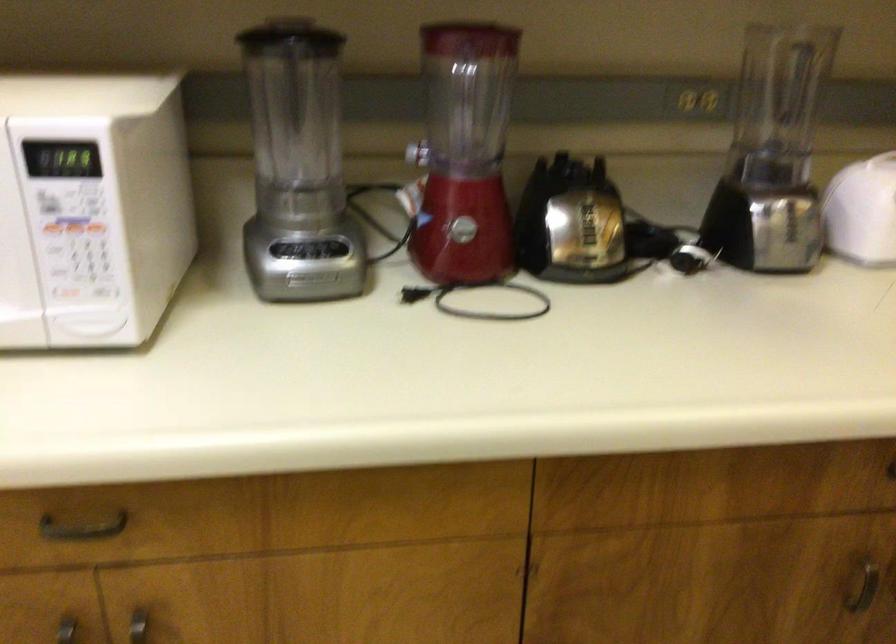
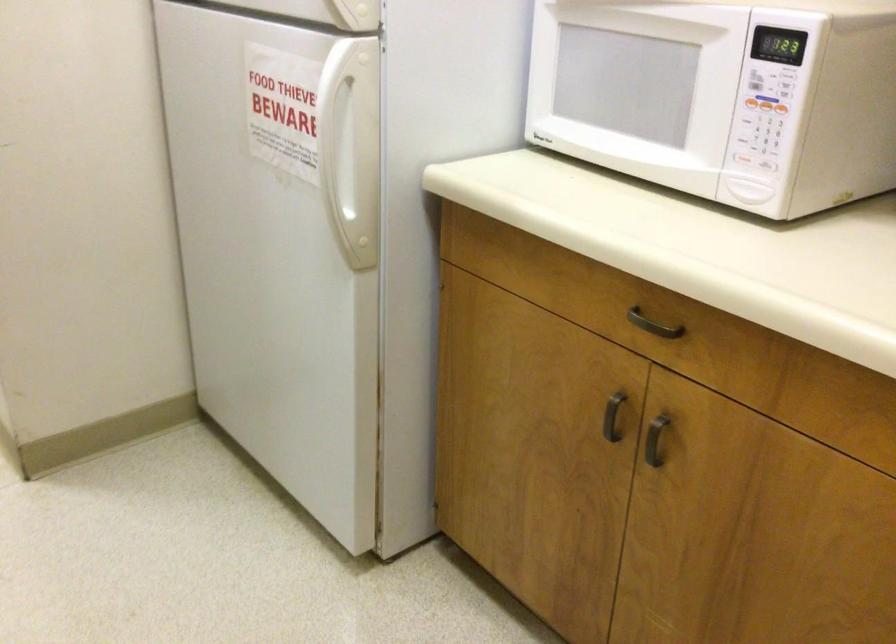
Question: The images are taken continuously from a first-person perspective. In which direction is your viewpoint rotating?

Choices:
 (A) Left
 (B) Right
 (C) Up
 (D) Down

Answer: (A)